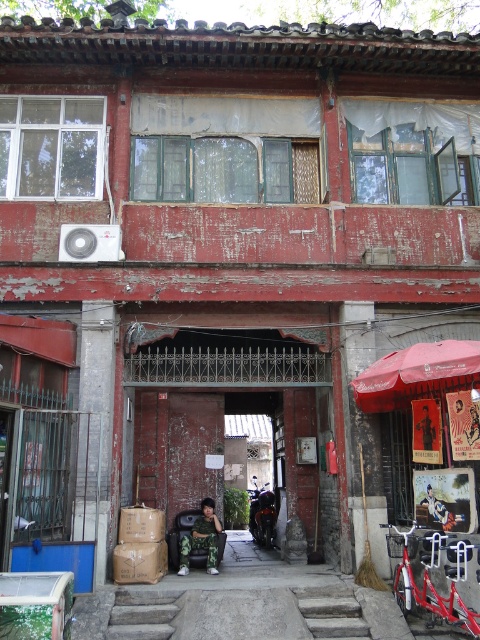
You are standing in front of the building and want to park your motorcycle. The shiny black motorcycle at center is currently blocking the stone steps at center. Can you move the motorcycle to a different spot without obstructing the steps?

The stone steps at center are closer to the viewer than the shiny black motorcycle at center, so moving the motorcycle away from the steps would prevent obstruction.

You are standing in front of the building and want to walk to the camouflage uniform at center. Which direction should you move relative to the stone steps at center?

The stone steps at center is positioned on the left side of camouflage uniform at center. Therefore, to reach the camouflage uniform at center, you should move to the right from the stone steps at center.